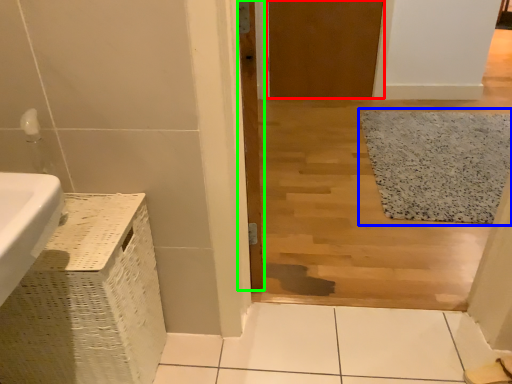
Question: Based on their relative distances, which object is farther from door (highlighted by a red box)? Choose from bath mat (highlighted by a blue box) and door (highlighted by a green box).

Choices:
 (A) bath mat
 (B) door

Answer: (B)